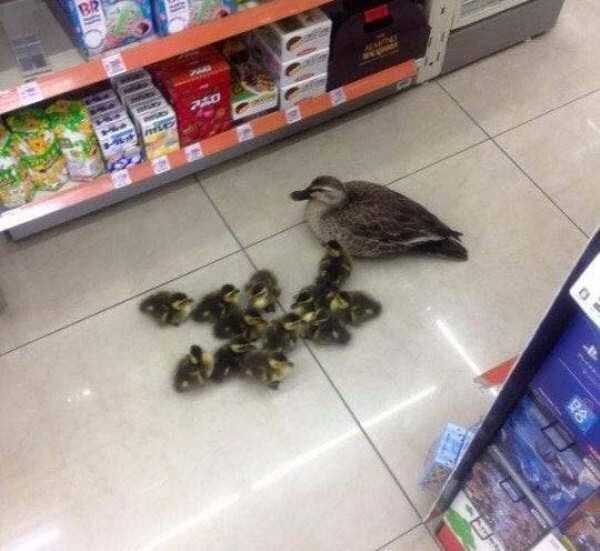
The height and width of the screenshot is (551, 600). What are the coordinates of `box` in the screenshot? It's located at (200, 84).